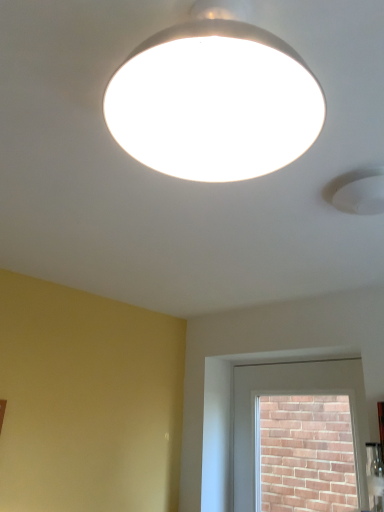
Question: In the image, is white matte lamp at upper center positioned in front of or behind brick at upper center?

Choices:
 (A) front
 (B) behind

Answer: (A)

Question: In terms of width, does white matte lamp at upper center look wider or thinner when compared to brick at upper center?

Choices:
 (A) thin
 (B) wide

Answer: (B)

Question: Do you think white matte lamp at upper center is within brick at upper center, or outside of it?

Choices:
 (A) inside
 (B) outside

Answer: (B)

Question: Is brick at upper center spatially inside white matte lamp at upper center, or outside of it?

Choices:
 (A) outside
 (B) inside

Answer: (A)

Question: Considering the positions of point (240, 501) and point (264, 145), is point (240, 501) closer or farther from the camera than point (264, 145)?

Choices:
 (A) closer
 (B) farther

Answer: (B)

Question: Visually, is brick at upper center positioned to the left or to the right of white matte lamp at upper center?

Choices:
 (A) right
 (B) left

Answer: (A)

Question: From a real-world perspective, is brick at upper center above or below white matte lamp at upper center?

Choices:
 (A) below
 (B) above

Answer: (A)